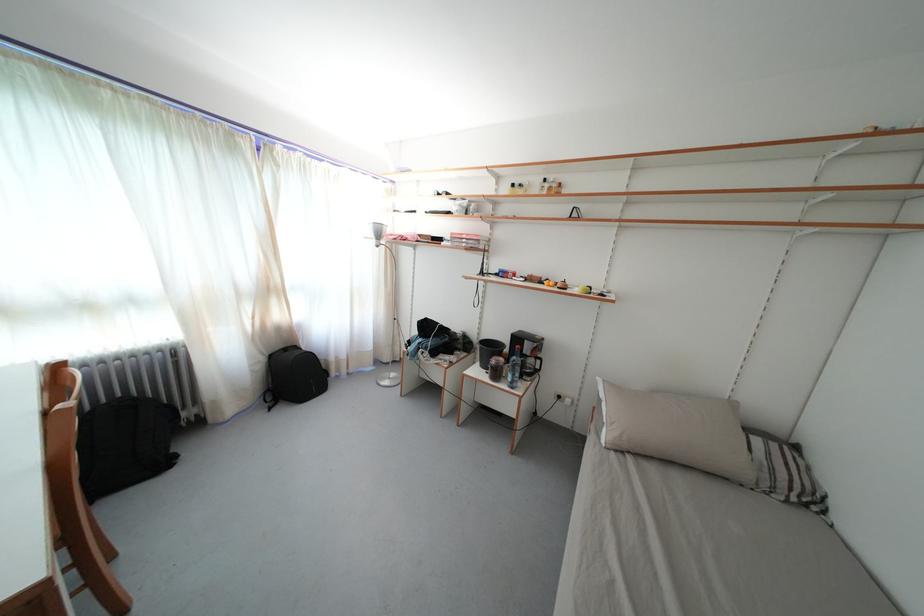
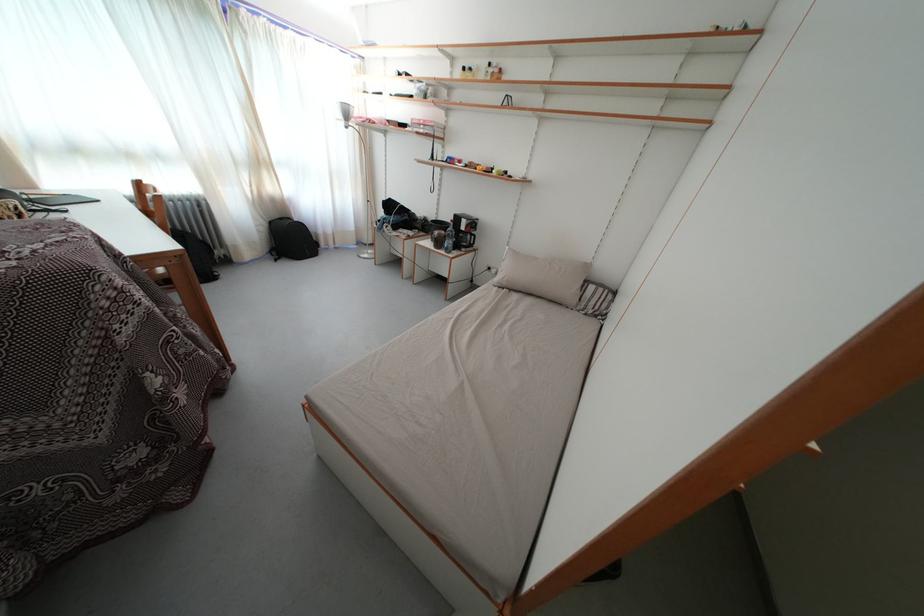
In the second image, find the point that corresponds to the point at 574,406 in the first image.

(500, 276)